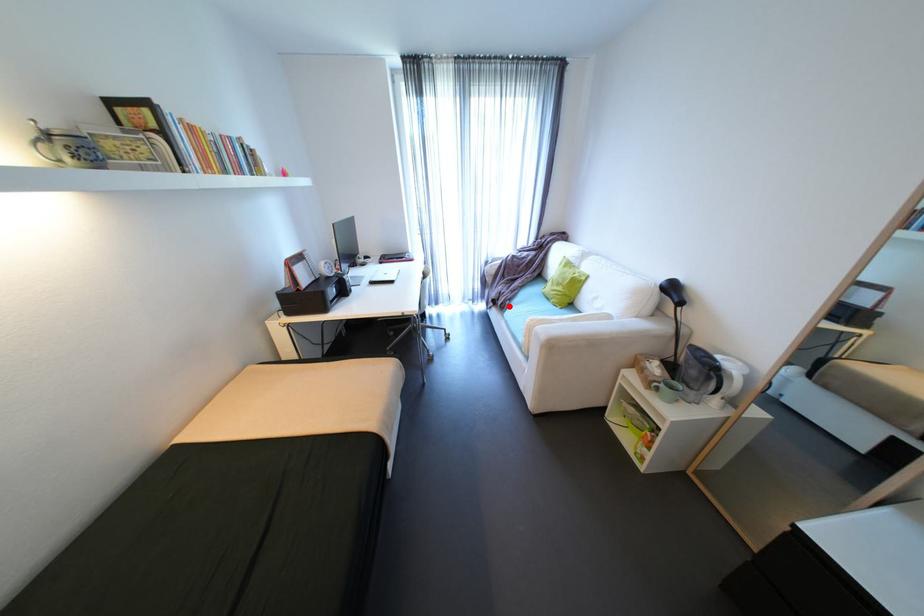
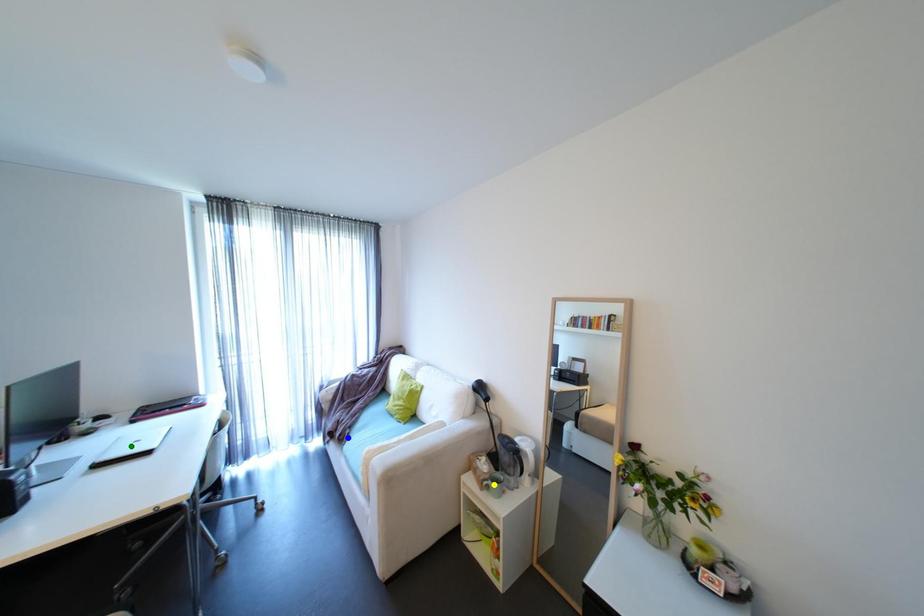
Question: I am providing you with two images of the same scene from different viewpoints. A red point is marked on the first image. You are given multiple points on the second image. In image 2, which mark is for the same physical point as the one in image 1?

Choices:
 (A) blue point
 (B) yellow point
 (C) green point

Answer: (A)